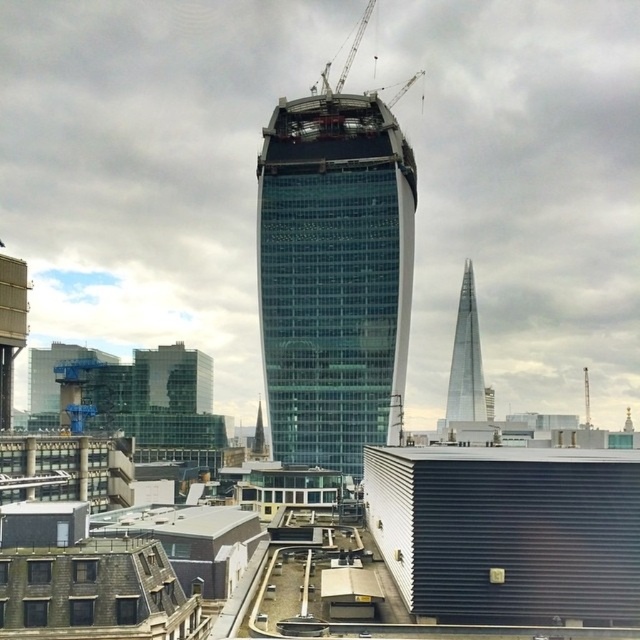
You are a construction worker standing on the ground floor of the transparent glass skyscraper at center. You need to move a heavy tool to the metallic construction crane at upper center. The tool weighs 50 kg and requires a clear path. Is the distance between them sufficient for a crane operator to safely lift the tool without needing to move either structure?

The distance between the transparent glass skyscraper at center and the metallic construction crane at upper center is 53.17 meters. Since the crane operator can safely operate at this distance without needing to move either structure, the tool can be lifted successfully.

You are an architect reviewing the city layout. You notice the transparent glass skyscraper at center and the transparent glass tower at right. Which of these two structures is positioned higher in the image?

The transparent glass skyscraper at center is positioned higher in the image than the transparent glass tower at right.

You are a city planner evaluating the skyline. Which of the two transparent glass structures, the transparent glass skyscraper at center or the transparent glass tower at right, has a greater height?

The transparent glass skyscraper at center is taller than the transparent glass tower at right, so it has a greater height.